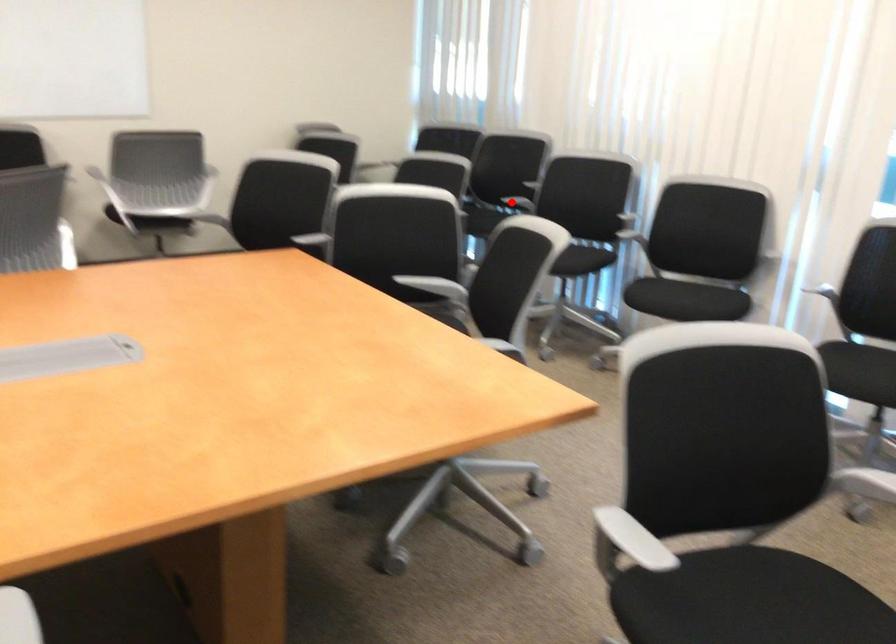
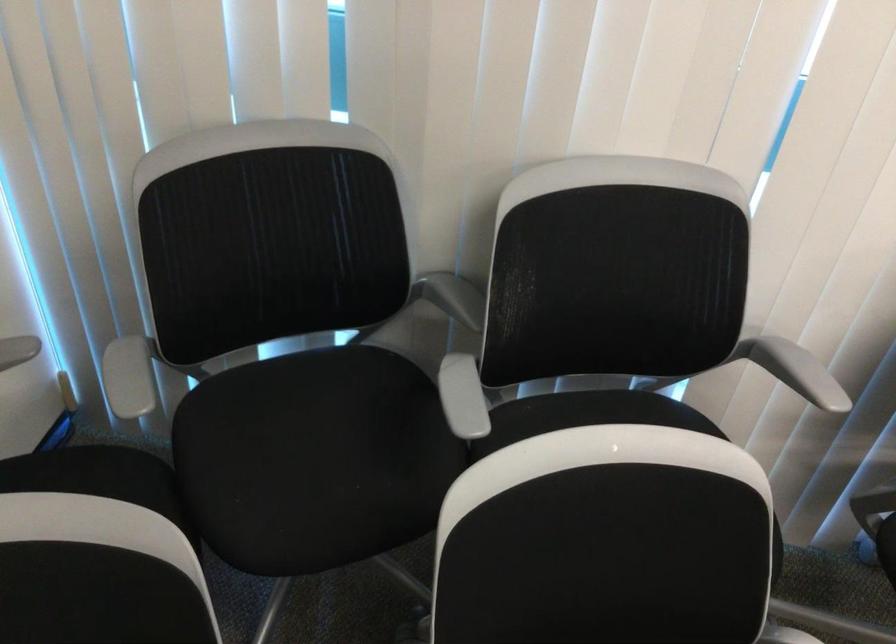
Question: I am providing you with two images of the same scene from different viewpoints. A red point is shown in image1. For the corresponding object point in image2, is it positioned nearer or farther from the camera?

Choices:
 (A) Nearer
 (B) Farther

Answer: (A)